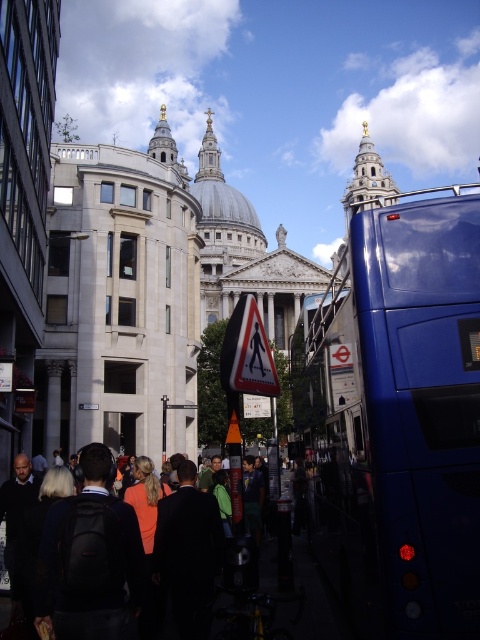
You are a city planner analyzing traffic flow. You observe the blue metallic bus at right and the white plastic pedestrian sign at center. Which object takes up more horizontal space in the image?

The blue metallic bus at right has a larger width than the white plastic pedestrian sign at center, so it takes up more horizontal space.

You are a photographer standing in the middle of the street. You want to take a photo of the blue metallic bus at right and the white plastic pedestrian sign at center. Which object will appear larger in your photo?

The blue metallic bus at right is much taller than the white plastic pedestrian sign at center, so it will appear larger in the photo.